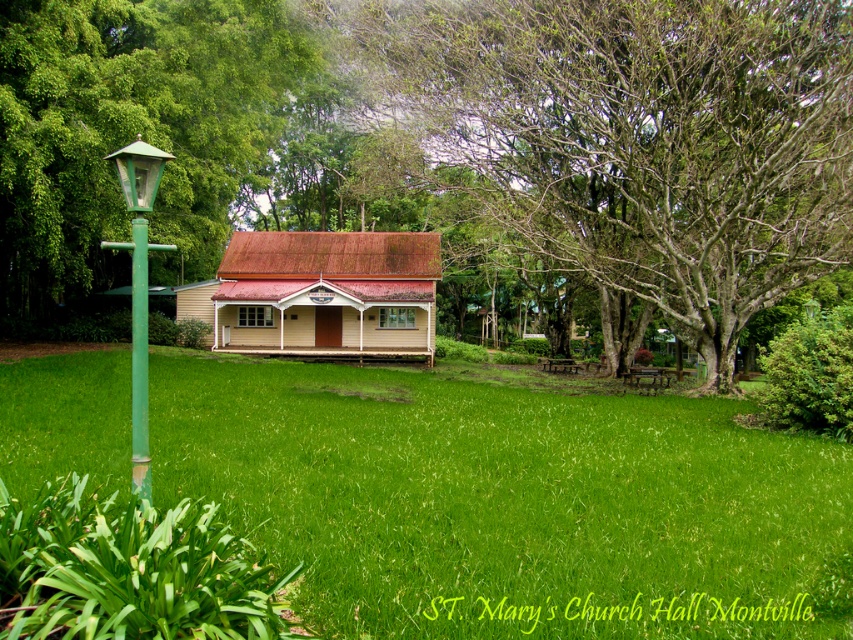
You are standing at the entrance of St. Marys Church Hall in Montville. You see a point marked at coordinate [131,132]. What object is located at that point?

The point at coordinate [131,132] indicates a green leafy tree at left.

You are standing at the entrance of St. Marys Church Hall in Montville. You want to locate the smooth bark tree at center. Which direction should you look to find it?

You should look towards the center of the scene to find the smooth bark tree at center, as it is located at point [631,138].

You are standing in front of St. Marys Church Hall in Montville and notice a smooth bark tree at center and a green painted metal lamp post at left. Which object is higher in the scene?

The smooth bark tree at center is higher than the green painted metal lamp post at left.